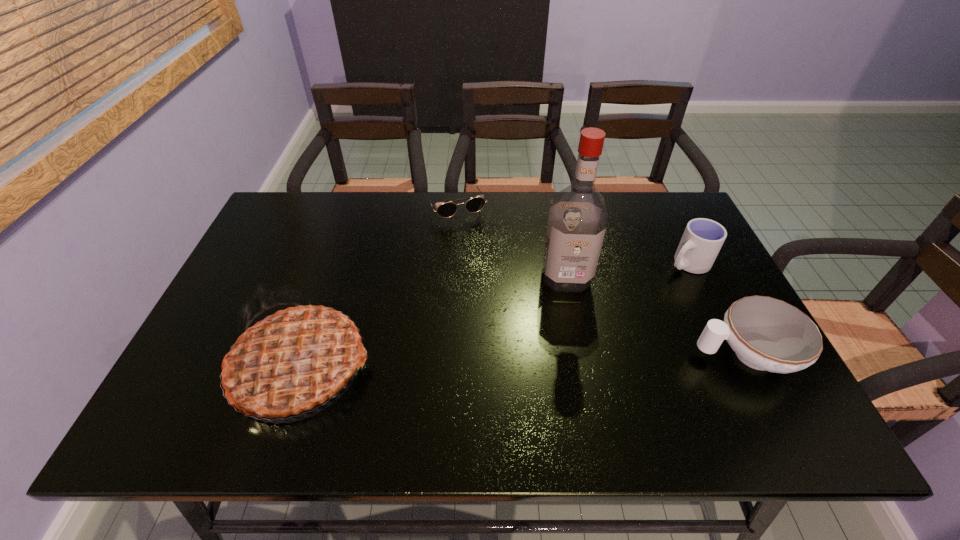
The height and width of the screenshot is (540, 960). Identify the location of the leftmost object. (292, 360).

This screenshot has width=960, height=540. In order to click on the fourth shortest object in this screenshot , I will do `click(292, 360)`.

The height and width of the screenshot is (540, 960). I want to click on the fourth tallest object, so click(769, 334).

Locate an element on the screen. the third object from left to right is located at coordinates (577, 222).

Where is `liquor`? This screenshot has height=540, width=960. liquor is located at coordinates (577, 222).

What are the coordinates of `cup` in the screenshot? It's located at (703, 238).

At what (x,y) coordinates should I click in order to perform the action: click on the fourth object from right to left. Please return your answer as a coordinate pair (x, y). Looking at the image, I should click on (473, 205).

The width and height of the screenshot is (960, 540). I want to click on sunglasses, so click(473, 205).

At what (x,y) coordinates should I click in order to perform the action: click on vacant space located on the back of the second tallest object. Please return your answer as a coordinate pair (x, y). This screenshot has width=960, height=540. Looking at the image, I should click on (340, 253).

In order to click on vacant region located on the side with the handle of the fourth tallest object in this screenshot , I will do `click(520, 354)`.